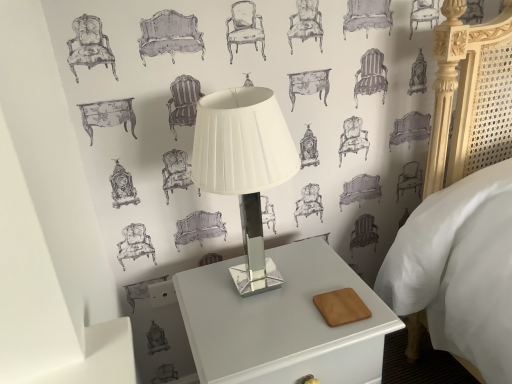
You are a GUI agent. You are given a task and a screenshot of the screen. Output one action in this format:
    pyautogui.click(x=<x>, y=<y>)
    Task: Click on the blank space to the left of white glossy table lamp at center
    The image size is (512, 384).
    Given the screenshot: What is the action you would take?
    pyautogui.click(x=198, y=293)